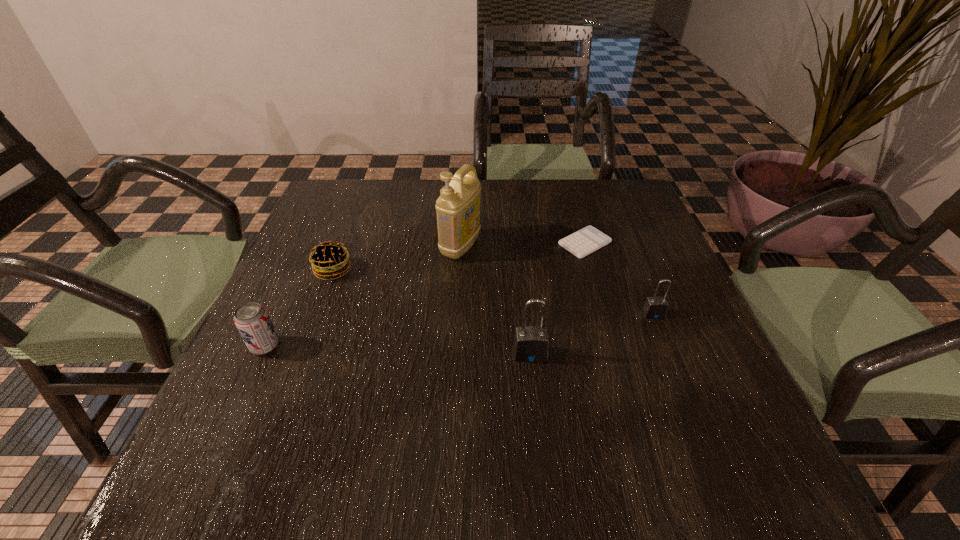
Identify the location of vacant position in the image that satisfies the following two spatial constraints: 1. on the back side of the fifth object from left to right; 2. on the right side of the fifth object from right to left. The image size is (960, 540). (344, 243).

The height and width of the screenshot is (540, 960). Identify the location of free spot that satisfies the following two spatial constraints: 1. on the back side of the beer can; 2. on the left side of the second object from left to right. (300, 270).